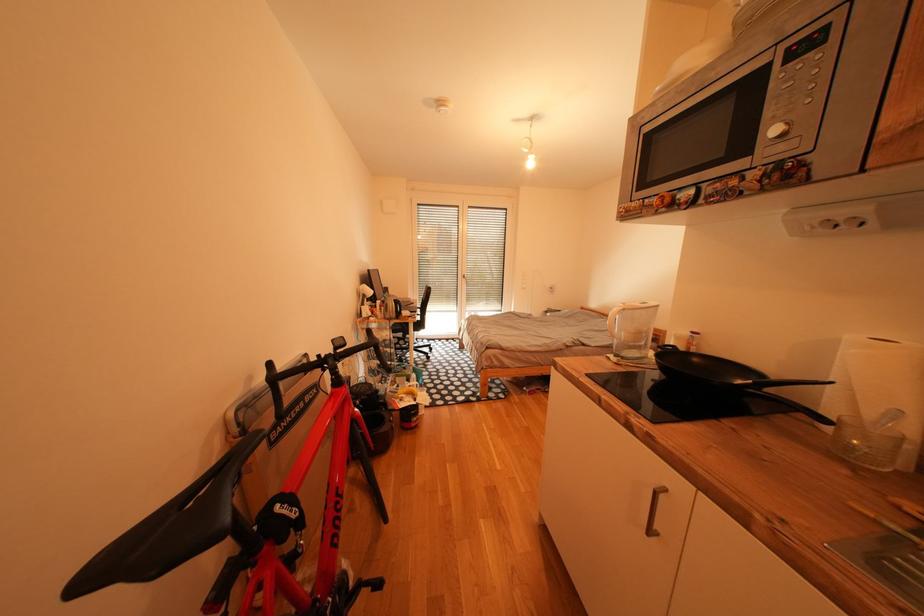
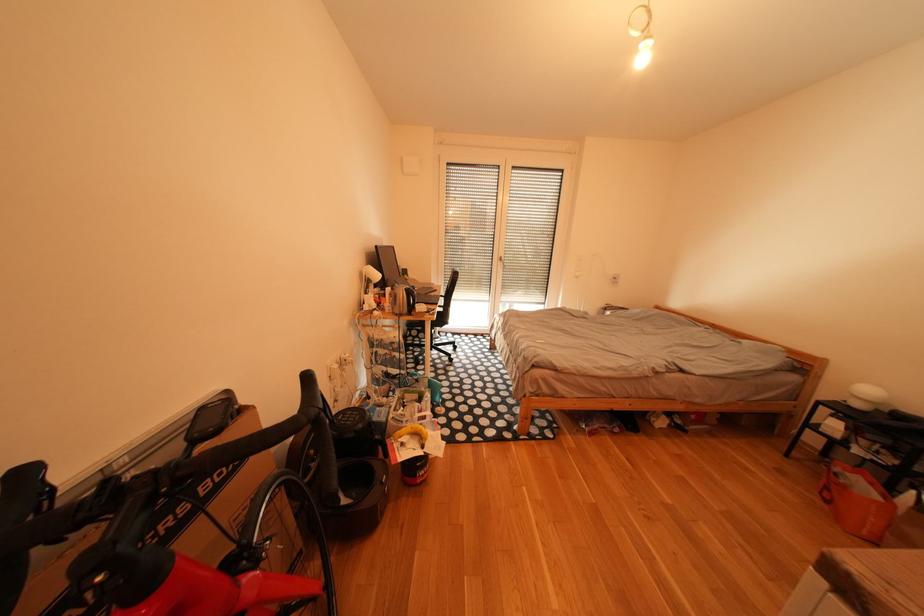
Question: The camera is either moving clockwise (left) or counter-clockwise (right) around the object. The first image is from the beginning of the video and the second image is from the end. Is the camera moving left or right when shooting the video?

Choices:
 (A) Left
 (B) Right

Answer: (B)